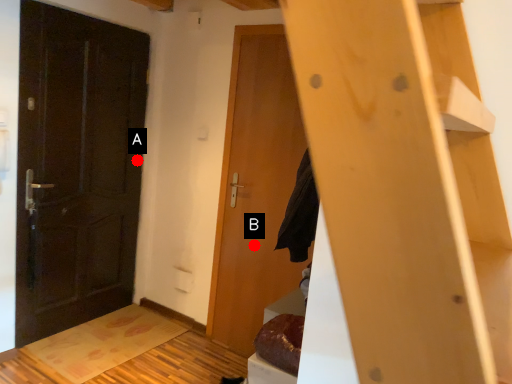
Question: Two points are circled on the image, labeled by A and B beside each circle. Among these points, which one is farthest from the camera?

Choices:
 (A) A is further
 (B) B is further

Answer: (A)